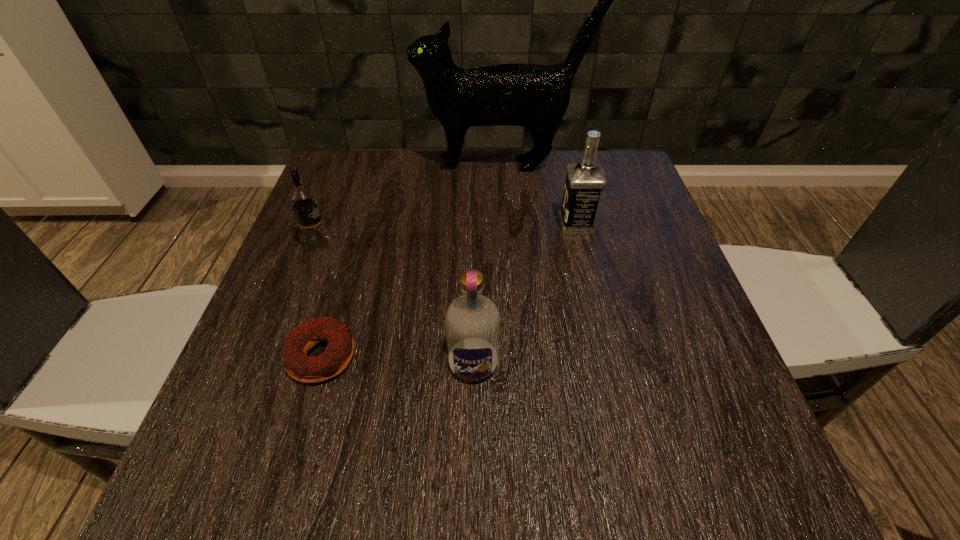
Image resolution: width=960 pixels, height=540 pixels. In order to click on empty space between the rightmost vodka and the nearest vodka in this screenshot , I will do `click(525, 294)`.

I want to click on vacant space in between the leftmost vodka and the second farthest object, so point(447,234).

Locate an element on the screen. free space between the cat and the nearest vodka is located at coordinates (488, 264).

At what (x,y) coordinates should I click in order to perform the action: click on free space between the second vodka from left to right and the leftmost vodka. Please return your answer as a coordinate pair (x, y). Looking at the image, I should click on (396, 303).

Locate an element on the screen. The image size is (960, 540). vacant area that lies between the nearest vodka and the farthest object is located at coordinates point(488,264).

You are a GUI agent. You are given a task and a screenshot of the screen. Output one action in this format:
    pyautogui.click(x=<x>, y=<y>)
    Task: Click on the empty space that is in between the nearest vodka and the third farthest object
    
    Given the screenshot: What is the action you would take?
    pyautogui.click(x=396, y=303)

You are a GUI agent. You are given a task and a screenshot of the screen. Output one action in this format:
    pyautogui.click(x=<x>, y=<y>)
    Task: Click on the vacant space in between the nearest vodka and the second nearest vodka
    This screenshot has height=540, width=960.
    Given the screenshot: What is the action you would take?
    pyautogui.click(x=396, y=303)

Locate an element on the screen. The image size is (960, 540). free spot between the nearest vodka and the farthest object is located at coordinates (488, 264).

Image resolution: width=960 pixels, height=540 pixels. What are the coordinates of `free spot between the tallest object and the farthest vodka` in the screenshot? It's located at (540, 195).

Identify the location of object that is the nearest to the rightmost vodka. (536, 97).